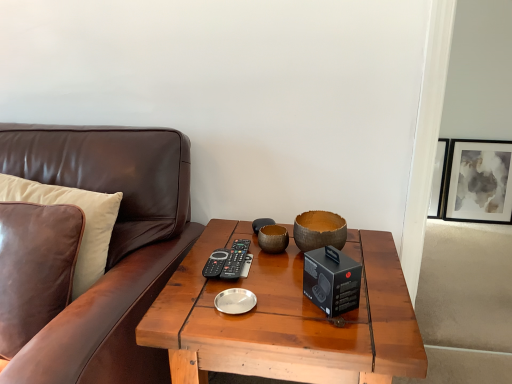
Identify the location of free location in front of natural wood bowl at center. (316, 309).